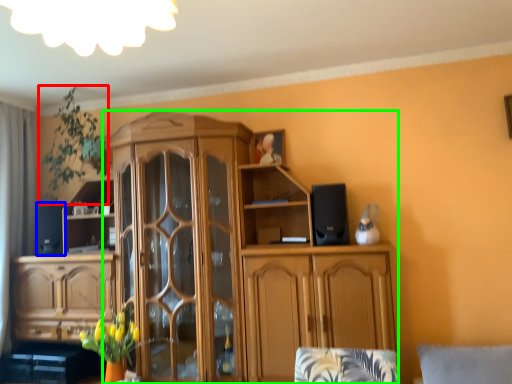
Question: Which object is positioned farthest from plant (highlighted by a red box)? Select from speaker (highlighted by a blue box) and cabinetry (highlighted by a green box).

Choices:
 (A) speaker
 (B) cabinetry

Answer: (B)